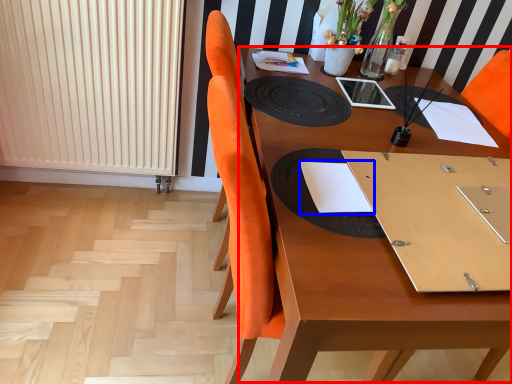
Question: Which object appears closest to the camera in this image, round table (highlighted by a red box) or notebook (highlighted by a blue box)?

Choices:
 (A) round table
 (B) notebook

Answer: (A)